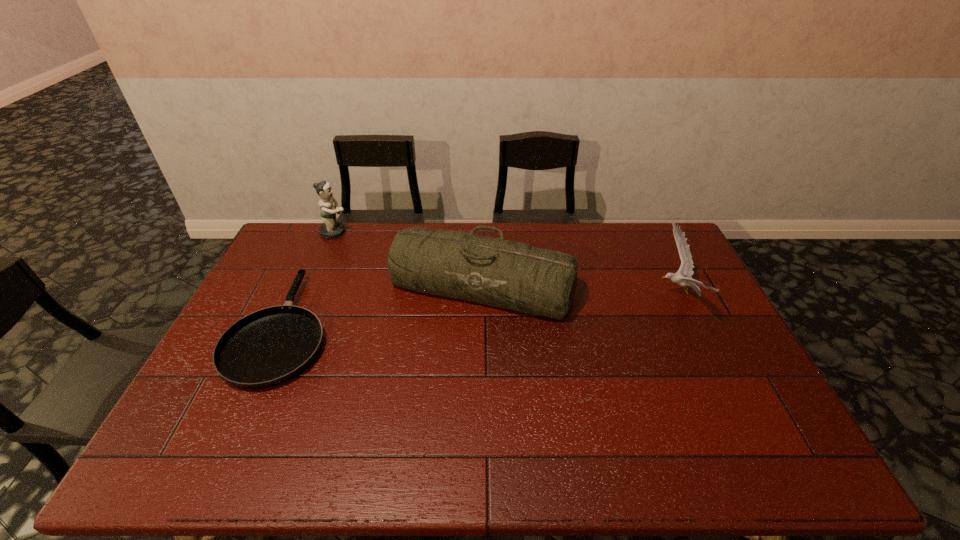
Where is `free space located 0.290m on the handle side of the frying pan`? Image resolution: width=960 pixels, height=540 pixels. free space located 0.290m on the handle side of the frying pan is located at coordinates (328, 229).

At what (x,y) coordinates should I click in order to perform the action: click on vacant space located on the handle side of the frying pan. Please return your answer as a coordinate pair (x, y). Image resolution: width=960 pixels, height=540 pixels. Looking at the image, I should click on (322, 242).

Identify the location of figurine situated at the far edge. The image size is (960, 540). (330, 229).

The width and height of the screenshot is (960, 540). I want to click on duffel bag that is at the far edge, so click(x=512, y=275).

At what (x,y) coordinates should I click in order to perform the action: click on gull that is at the far edge. Please return your answer as a coordinate pair (x, y). This screenshot has width=960, height=540. Looking at the image, I should click on (683, 277).

Identify the location of figurine that is at the left edge. The image size is (960, 540). click(x=330, y=229).

Identify the location of frying pan that is at the left edge. This screenshot has height=540, width=960. click(268, 347).

Identify the location of object present at the right edge. (683, 277).

Locate an element on the screen. The height and width of the screenshot is (540, 960). object situated at the far left corner is located at coordinates (330, 229).

Identify the location of object that is at the far right corner. (683, 277).